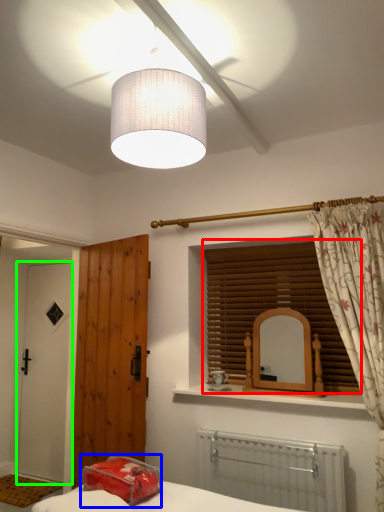
Question: Estimate the real-world distances between objects in this image. Which object is closer to window blind (highlighted by a red box), pillow (highlighted by a blue box) or door (highlighted by a green box)?

Choices:
 (A) pillow
 (B) door

Answer: (A)